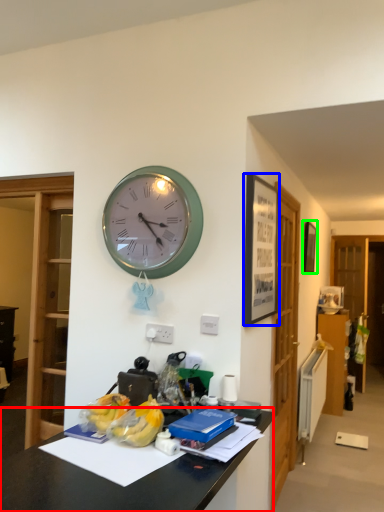
Question: Based on their relative distances, which object is farther from desk (highlighted by a red box)? Choose from picture frame (highlighted by a blue box) and picture frame (highlighted by a green box).

Choices:
 (A) picture frame
 (B) picture frame

Answer: (B)